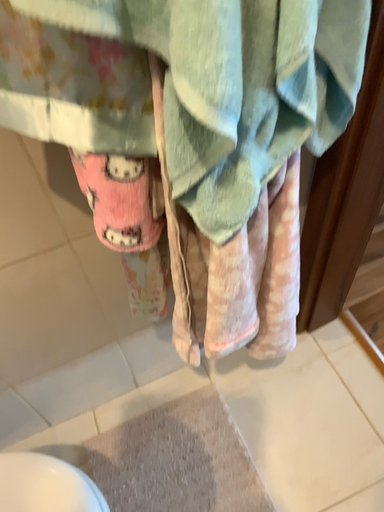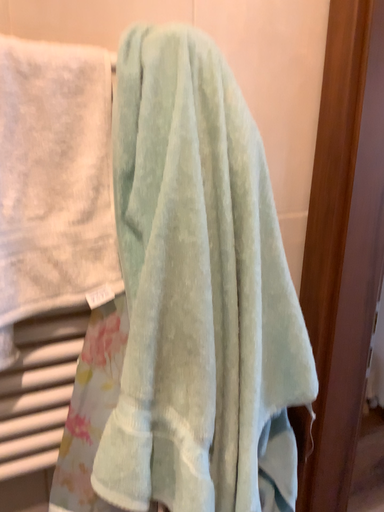
Question: Which way did the camera rotate in the video?

Choices:
 (A) rotated downward
 (B) rotated upward

Answer: (B)